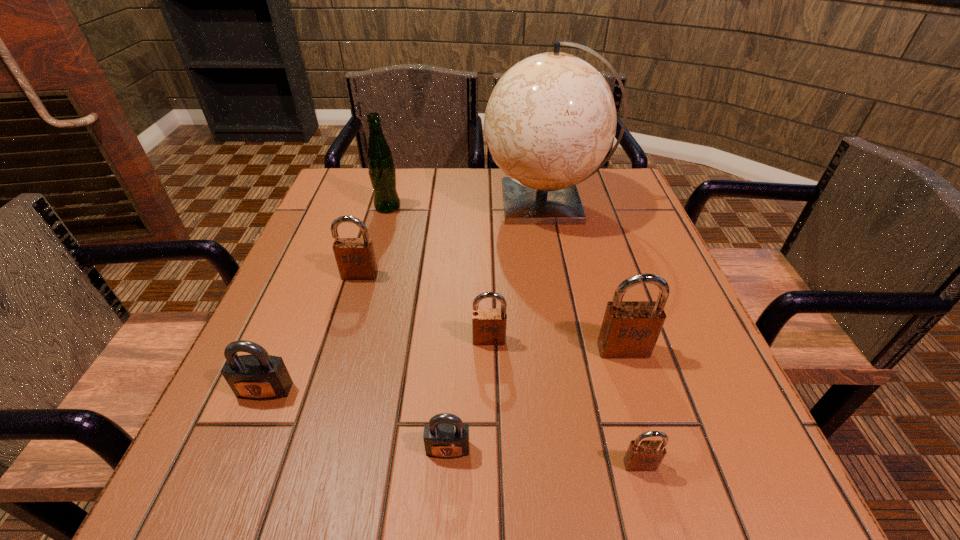
Find the location of a particular element. The height and width of the screenshot is (540, 960). globe is located at coordinates (551, 119).

Image resolution: width=960 pixels, height=540 pixels. Find the location of `the tallest object`. the tallest object is located at coordinates (551, 119).

Identify the location of beer bottle. This screenshot has height=540, width=960. point(381,169).

Find the location of a particular element. This screenshot has height=540, width=960. green beer bottle is located at coordinates coord(381,169).

Image resolution: width=960 pixels, height=540 pixels. I want to click on the third tallest object, so click(x=630, y=329).

I want to click on the biggest brown padlock, so click(630, 329).

Find the location of a particular element. The image size is (960, 540). the leftmost brown padlock is located at coordinates (355, 257).

The image size is (960, 540). What are the coordinates of `the fifth shortest padlock` in the screenshot? It's located at (355, 257).

This screenshot has height=540, width=960. In order to click on the third brown padlock from right to left in this screenshot , I will do `click(488, 325)`.

Locate an element on the screen. The height and width of the screenshot is (540, 960). the third biggest brown padlock is located at coordinates (488, 325).